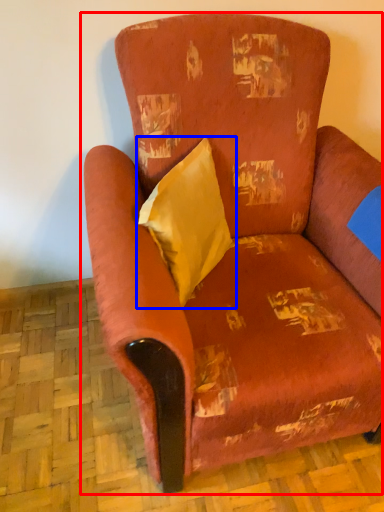
Question: Which object appears closest to the camera in this image, chair (highlighted by a red box) or throw pillow (highlighted by a blue box)?

Choices:
 (A) chair
 (B) throw pillow

Answer: (A)